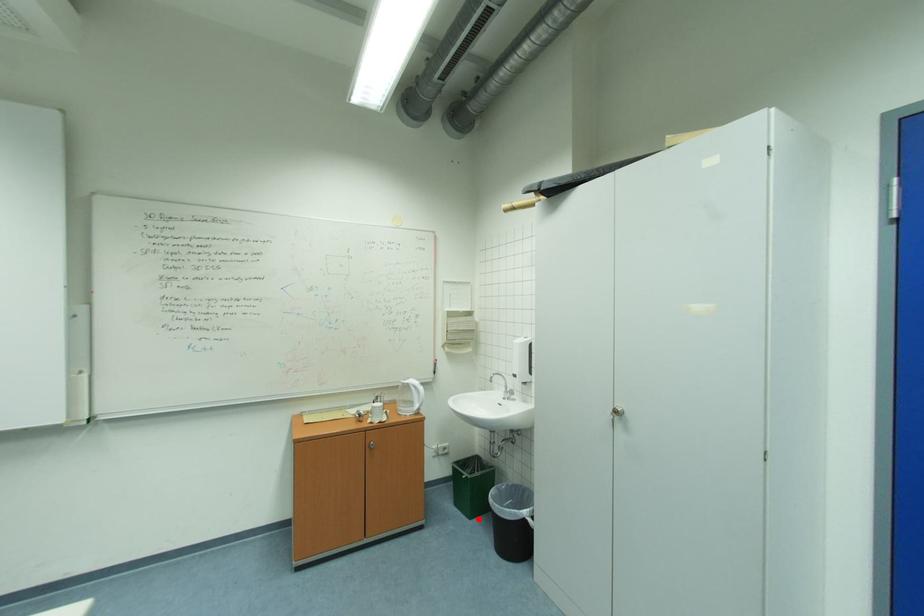
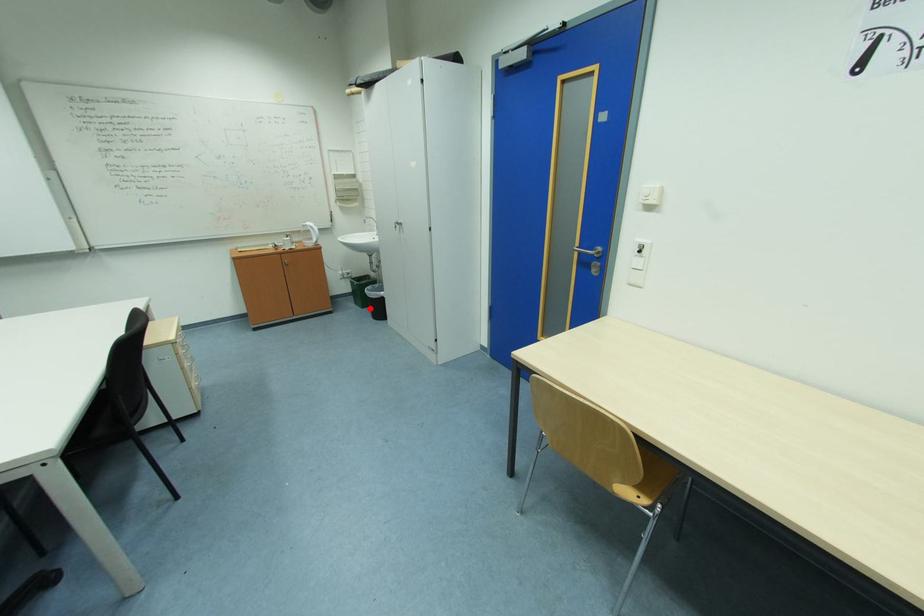
I am providing you with two images of the same scene from different viewpoints. A red point is marked on the first image and another point is marked on the second image. Does the point marked in image1 correspond to the same location as the one in image2?

Yes